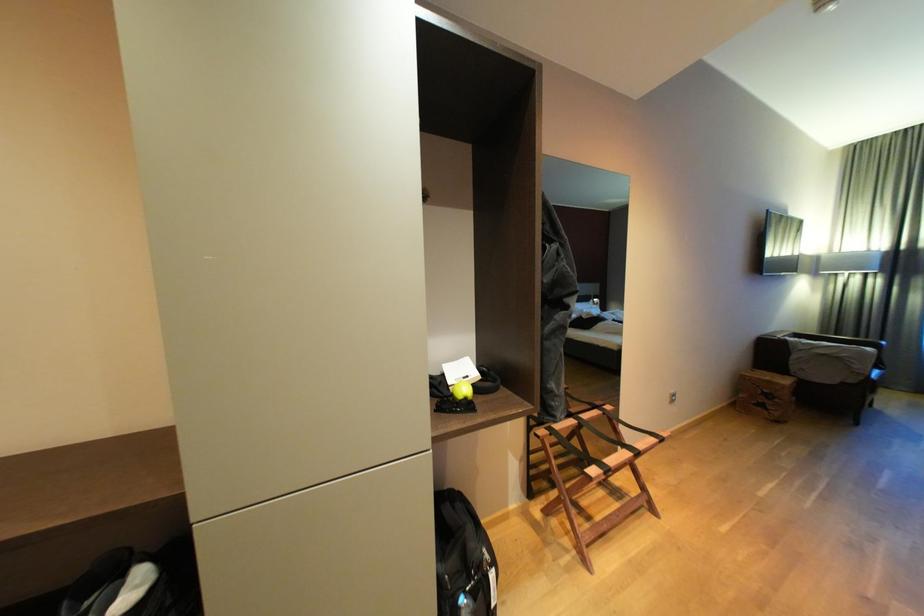
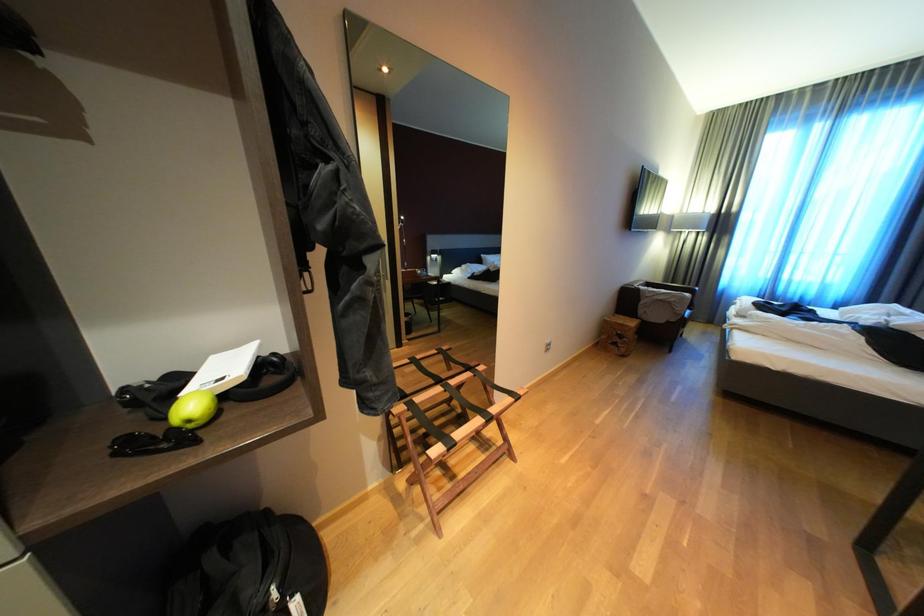
Which direction would the cameraman need to move to produce the second image?

The cameraman walked toward right, forward.